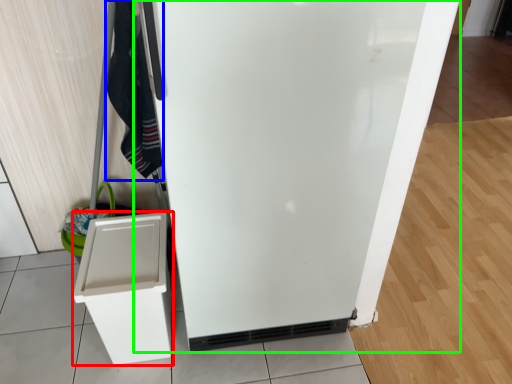
Question: Based on their relative distances, which object is nearer to cabinetry (highlighted by a red box)? Choose from clothing (highlighted by a blue box) and refrigerator (highlighted by a green box).

Choices:
 (A) clothing
 (B) refrigerator

Answer: (A)